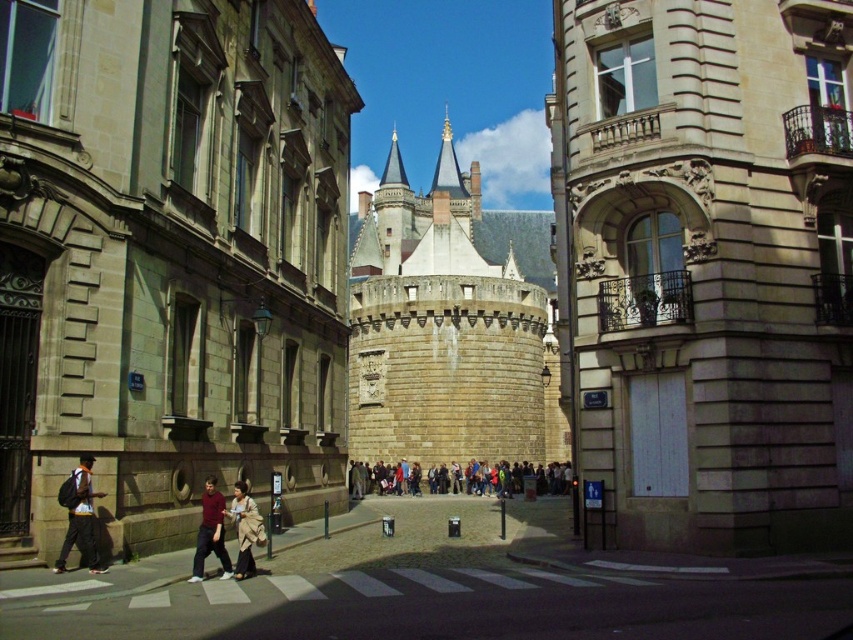
Question: Which point is farther to the camera?

Choices:
 (A) dark gray fabric jacket at center
 (B) light brown leather jacket at center

Answer: (A)

Question: Considering the real-world distances, which object is farthest from the light brown leather jacket at center?

Choices:
 (A) dark gray backpack at left
 (B) dark gray fabric jacket at center
 (C) stone castle at center

Answer: (B)

Question: Is stone tower at center to the right of light brown leather jacket at center from the viewer's perspective?

Choices:
 (A) yes
 (B) no

Answer: (A)

Question: Is dark gray backpack at left closer to the viewer compared to dark gray fabric jacket at center?

Choices:
 (A) yes
 (B) no

Answer: (A)

Question: Can you confirm if stone castle at center is thinner than dark red fabric pants at lower center?

Choices:
 (A) yes
 (B) no

Answer: (B)

Question: Which of the following is the closest to the observer?

Choices:
 (A) dark gray fabric jacket at center
 (B) light brown leather jacket at center
 (C) dark gray backpack at left
 (D) stone tower at center

Answer: (C)